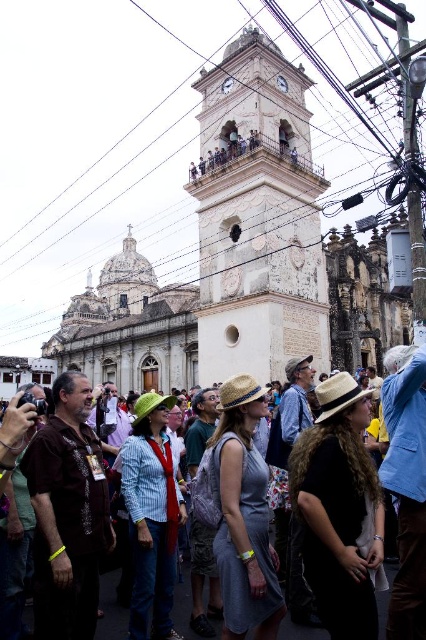
You are a photographer standing in the crowd and want to take a clear photo of the tower without any obstructions. The metallic wire at upper center and the denim jacket at center are in your line of view. Which object is closer to you and might block your view?

The denim jacket at center is closer to you than the metallic wire at upper center, so it might block your view.